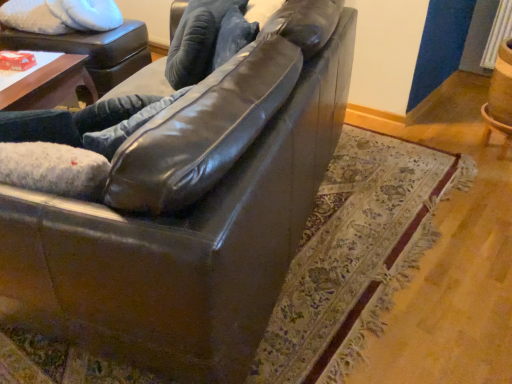
Question: Is shiny brown leather couch at center placed right next to shiny black leather couch at center?

Choices:
 (A) yes
 (B) no

Answer: (B)

Question: Does shiny brown leather couch at center have a lesser width compared to shiny black leather couch at center?

Choices:
 (A) no
 (B) yes

Answer: (A)

Question: Considering the relative sizes of shiny brown leather couch at center and shiny black leather couch at center in the image provided, is shiny brown leather couch at center wider than shiny black leather couch at center?

Choices:
 (A) yes
 (B) no

Answer: (A)

Question: From the image's perspective, is shiny brown leather couch at center below shiny black leather couch at center?

Choices:
 (A) yes
 (B) no

Answer: (B)

Question: Does shiny brown leather couch at center appear on the right side of shiny black leather couch at center?

Choices:
 (A) yes
 (B) no

Answer: (A)

Question: Choose the correct answer: Is shiny black leather couch at center inside matte black swivel chair at upper left or outside it?

Choices:
 (A) inside
 (B) outside

Answer: (B)

Question: From the image's perspective, is shiny black leather couch at center positioned above or below matte black swivel chair at upper left?

Choices:
 (A) below
 (B) above

Answer: (A)

Question: Based on their positions, is shiny black leather couch at center located to the left or right of matte black swivel chair at upper left?

Choices:
 (A) right
 (B) left

Answer: (A)

Question: Looking at their shapes, would you say shiny black leather couch at center is wider or thinner than matte black swivel chair at upper left?

Choices:
 (A) wide
 (B) thin

Answer: (B)

Question: Considering the positions of point (20, 31) and point (203, 74), is point (20, 31) closer or farther from the camera than point (203, 74)?

Choices:
 (A) closer
 (B) farther

Answer: (B)

Question: Is matte black swivel chair at upper left in front of or behind shiny black leather couch at center in the image?

Choices:
 (A) behind
 (B) front

Answer: (A)

Question: Considering the positions of matte black swivel chair at upper left and shiny black leather couch at center in the image, is matte black swivel chair at upper left bigger or smaller than shiny black leather couch at center?

Choices:
 (A) big
 (B) small

Answer: (A)

Question: Is matte black swivel chair at upper left wider or thinner than shiny black leather couch at center?

Choices:
 (A) wide
 (B) thin

Answer: (A)

Question: Is matte black swivel chair at upper left wider or thinner than shiny brown leather couch at center?

Choices:
 (A) wide
 (B) thin

Answer: (B)

Question: From a real-world perspective, relative to shiny brown leather couch at center, is matte black swivel chair at upper left vertically above or below?

Choices:
 (A) below
 (B) above

Answer: (A)